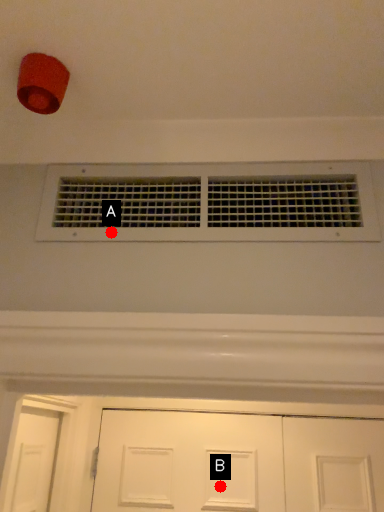
Question: Two points are circled on the image, labeled by A and B beside each circle. Which point appears closest to the camera in this image?

Choices:
 (A) A is closer
 (B) B is closer

Answer: (A)